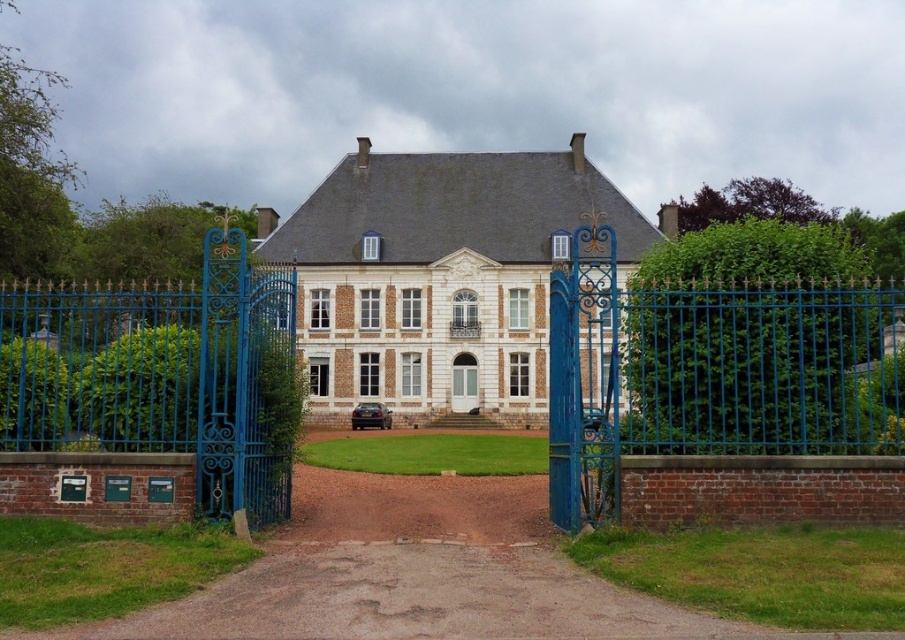
You are a visitor arriving at the house and need to choose between the white glossy door at center and the matte white door at center. Which door is closer to the driveway?

Both doors are at the center, so they are equally distant from the driveway. However, according to the description, the white glossy door at center and matte white door at center are 11.22 meters apart. This suggests there might be two doors at the center, but their exact positions relative to the driveway aren

You are a delivery person arriving at the manor. You need to enter the property to deliver a package. The blue wrought iron gate at left and the matte white door at center are both potential entry points. Which entry point is physically bigger in size?

The blue wrought iron gate at left is larger in size compared to the matte white door at center, so the blue wrought iron gate at left is the bigger entry point.

You are standing at the entrance of the property and want to walk towards the white brick mansion at center. Which direction should you move relative to the blue wrought iron gate at left?

You should move to the right of the blue wrought iron gate at left to reach the white brick mansion at center since it is positioned to the right of the gate.